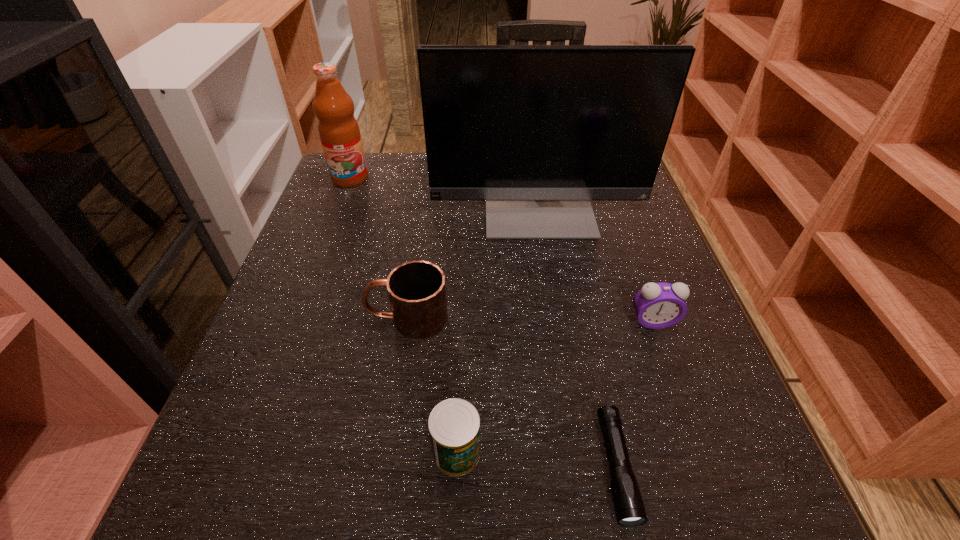
Find the location of `free location that satisfies the following two spatial constraints: 1. on the side of the mug with the handle; 2. on the right side of the can`. free location that satisfies the following two spatial constraints: 1. on the side of the mug with the handle; 2. on the right side of the can is located at coordinates (387, 453).